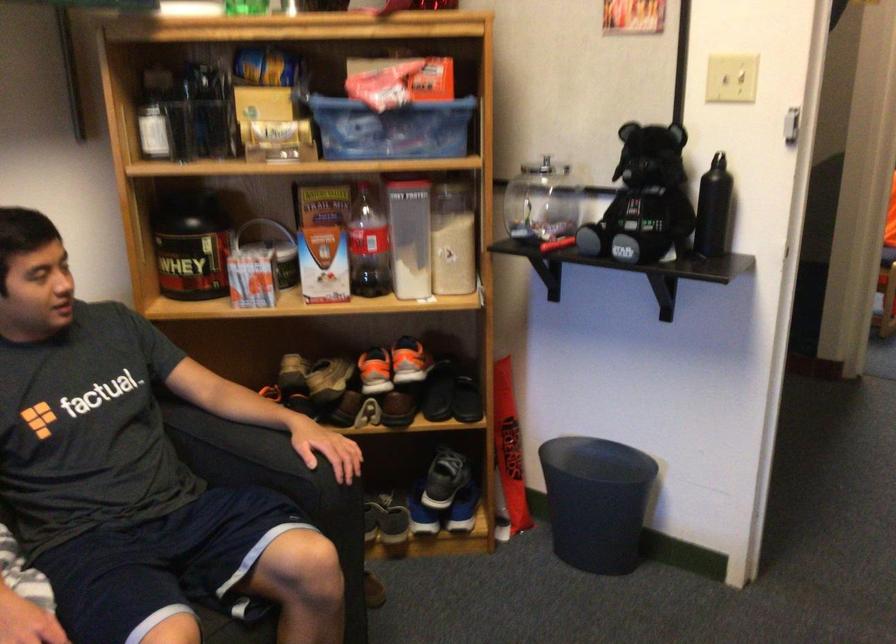
This screenshot has width=896, height=644. What do you see at coordinates (455, 184) in the screenshot?
I see `the white container lid` at bounding box center [455, 184].